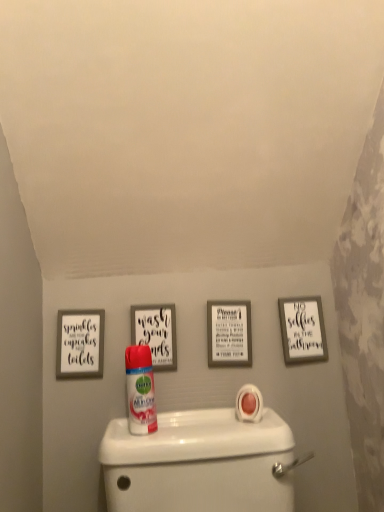
Question: From a real-world perspective, is matte black picture frame at center, which ranks as the second picture frame in left-to-right order, over white matte picture frame at center, which is the second picture frame from right to left?

Choices:
 (A) no
 (B) yes

Answer: (B)

Question: Can you confirm if matte black picture frame at center, arranged as the 3th picture frame when viewed from the right, is wider than white matte picture frame at center, which is the second picture frame from right to left?

Choices:
 (A) yes
 (B) no

Answer: (B)

Question: Does matte black picture frame at center, which ranks as the second picture frame in left-to-right order, have a lesser height compared to white matte picture frame at center, which is the second picture frame from right to left?

Choices:
 (A) yes
 (B) no

Answer: (A)

Question: Is matte black picture frame at center, which ranks as the second picture frame in left-to-right order, next to white matte picture frame at center, which is the second picture frame from right to left?

Choices:
 (A) no
 (B) yes

Answer: (A)

Question: Does matte black picture frame at center, which ranks as the second picture frame in left-to-right order, appear on the left side of white matte picture frame at center, which is the third picture frame in left-to-right order?

Choices:
 (A) no
 (B) yes

Answer: (B)

Question: Considering the positions of point (137, 439) and point (74, 330), is point (137, 439) closer or farther from the camera than point (74, 330)?

Choices:
 (A) farther
 (B) closer

Answer: (B)

Question: Would you say white glossy toilet at lower center is to the left or to the right of white matte picture frame at upper left, arranged as the 4th picture frame when viewed from the right, in the picture?

Choices:
 (A) left
 (B) right

Answer: (B)

Question: Considering the positions of white glossy toilet at lower center and white matte picture frame at upper left, arranged as the first picture frame when viewed from the left, in the image, is white glossy toilet at lower center taller or shorter than white matte picture frame at upper left, arranged as the first picture frame when viewed from the left,?

Choices:
 (A) tall
 (B) short

Answer: (A)

Question: From the image's perspective, is white glossy toilet at lower center positioned above or below white matte picture frame at upper left, arranged as the first picture frame when viewed from the left?

Choices:
 (A) below
 (B) above

Answer: (A)

Question: Looking at their shapes, would you say white matte picture frame at center, which is the second picture frame from right to left, is wider or thinner than matte black picture frame at center, arranged as the 3th picture frame when viewed from the right?

Choices:
 (A) thin
 (B) wide

Answer: (B)

Question: From a real-world perspective, is white matte picture frame at center, which is the second picture frame from right to left, physically located above or below matte black picture frame at center, which ranks as the second picture frame in left-to-right order?

Choices:
 (A) above
 (B) below

Answer: (B)

Question: Based on their positions, is white matte picture frame at center, which is the second picture frame from right to left, located to the left or right of matte black picture frame at center, arranged as the 3th picture frame when viewed from the right?

Choices:
 (A) left
 (B) right

Answer: (B)

Question: Considering their positions, is white matte picture frame at center, which is the second picture frame from right to left, located in front of or behind matte black picture frame at center, arranged as the 3th picture frame when viewed from the right?

Choices:
 (A) behind
 (B) front

Answer: (A)

Question: Does point (311, 355) appear closer or farther from the camera than point (162, 509)?

Choices:
 (A) farther
 (B) closer

Answer: (A)

Question: Considering their positions, is white matte picture frame at upper right, placed as the 1th picture frame when sorted from right to left, located in front of or behind white glossy toilet at lower center?

Choices:
 (A) behind
 (B) front

Answer: (A)